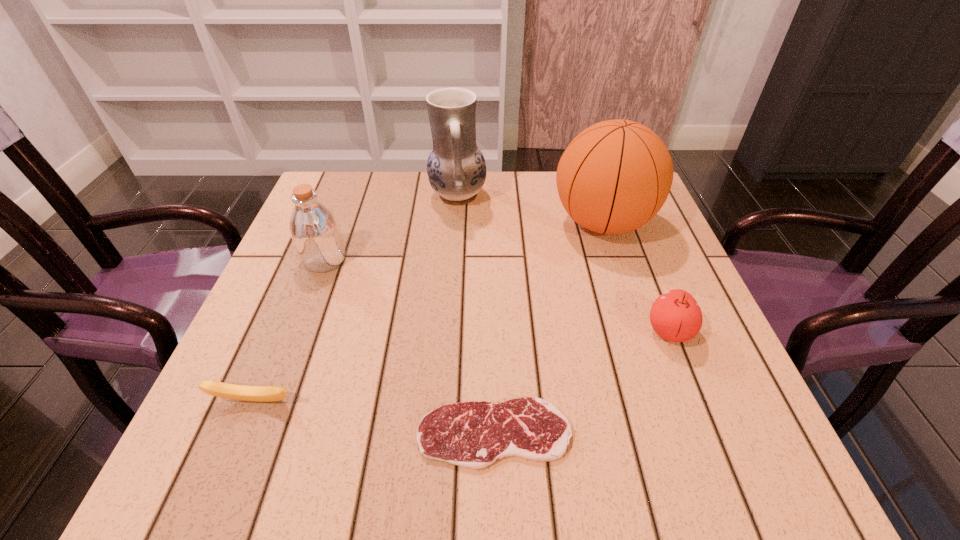
Where is `blank area located on the back of the apple`? The image size is (960, 540). blank area located on the back of the apple is located at coordinates (626, 221).

Where is `blank area located 0.100m at the stem of the fifth tallest object`? This screenshot has width=960, height=540. blank area located 0.100m at the stem of the fifth tallest object is located at coordinates (225, 471).

This screenshot has height=540, width=960. Find the location of `vacant point located on the back of the steak`. vacant point located on the back of the steak is located at coordinates (490, 254).

Where is `pottery that is at the far edge`? The height and width of the screenshot is (540, 960). pottery that is at the far edge is located at coordinates (456, 168).

Find the location of a particular element. The height and width of the screenshot is (540, 960). basketball positioned at the far edge is located at coordinates (615, 176).

Where is `object that is at the near edge`? The image size is (960, 540). object that is at the near edge is located at coordinates (474, 435).

This screenshot has height=540, width=960. What are the coordinates of `bottle located in the left edge section of the desktop` in the screenshot? It's located at (314, 229).

Where is `banana positioned at the left edge`? banana positioned at the left edge is located at coordinates (219, 389).

This screenshot has height=540, width=960. What are the coordinates of `basketball positioned at the right edge` in the screenshot? It's located at (615, 176).

Identify the location of apple that is positioned at the right edge. (675, 315).